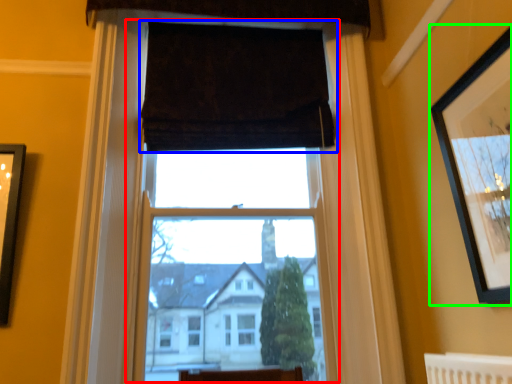
Question: Estimate the real-world distances between objects in this image. Which object is farther from window frame (highlighted by a red box), curtain (highlighted by a blue box) or picture frame (highlighted by a green box)?

Choices:
 (A) curtain
 (B) picture frame

Answer: (B)